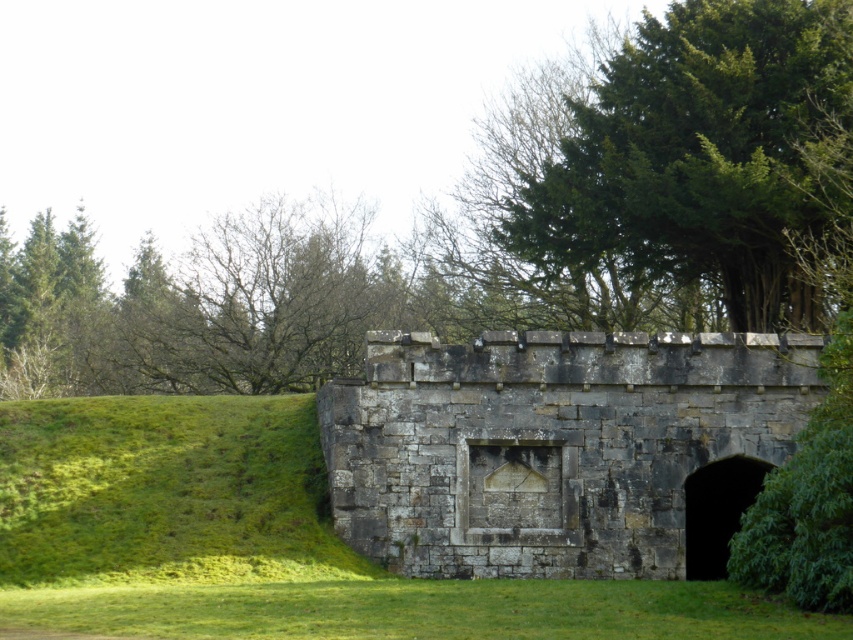
Image resolution: width=853 pixels, height=640 pixels. What do you see at coordinates (500, 225) in the screenshot?
I see `green leafy tree at upper center` at bounding box center [500, 225].

Can you confirm if green leafy tree at upper center is positioned to the left of gray stone bunker at center?

Yes, green leafy tree at upper center is to the left of gray stone bunker at center.

Is point (431, 209) closer to viewer compared to point (659, 384)?

No.

In order to click on green leafy tree at upper center in this screenshot , I will do `click(500, 225)`.

Between green leafy tree at upper center and green leafy tree at upper right, which one has less height?

With less height is green leafy tree at upper right.

Which is in front, point (612, 220) or point (633, 115)?

Point (612, 220) is in front.

Between point (517, 93) and point (711, 76), which one is positioned in front?

Point (711, 76) is in front.

The height and width of the screenshot is (640, 853). What are the coordinates of `green leafy tree at upper center` in the screenshot? It's located at (500, 225).

Does gray stone bunker at center lie in front of green leafy tree at upper right?

Yes, it is.

Does gray stone bunker at center appear under green leafy tree at upper right?

Yes, gray stone bunker at center is below green leafy tree at upper right.

Describe the element at coordinates (560, 449) in the screenshot. I see `gray stone bunker at center` at that location.

Where is `gray stone bunker at center`? gray stone bunker at center is located at coordinates (560, 449).